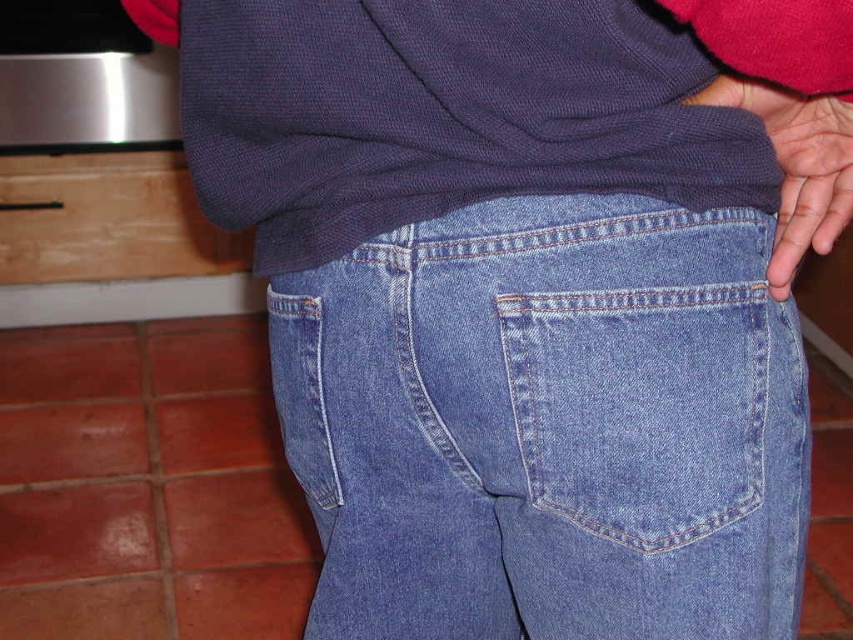
You are trying to fit a pair of denim blue jeans at center into a drawer. The drawer has a width exactly matching the denim blue jeans pocket at center. Will the jeans fit into the drawer?

The denim blue jeans at center is wider than the denim blue jeans pocket at center, so the jeans will not fit into the drawer since the drawer is sized to match the pocket width.

You are trying to determine if the denim blue jeans pocket at center can fit into the matte blue jeans at lower right. Based on their sizes, is this possible?

The denim blue jeans pocket at center is much taller than the matte blue jeans at lower right, so it cannot fit into the matte blue jeans at lower right due to its height difference.